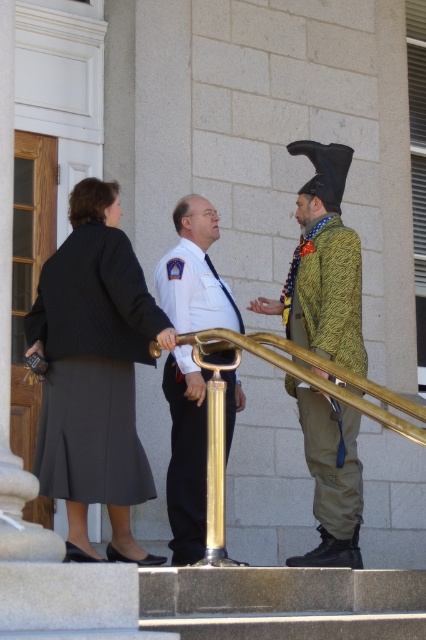
Between dark gray wool skirt at center and white uniform at center, which one appears on the right side from the viewer's perspective?

Positioned to the right is white uniform at center.

Between dark gray wool skirt at center and white uniform at center, which one is positioned higher?

dark gray wool skirt at center

Does point (101, 272) come behind point (233, 323)?

That is False.

Where is `dark gray wool skirt at center`? dark gray wool skirt at center is located at coordinates (94, 371).

Does point (129, 404) come farther from viewer compared to point (310, 305)?

No, it is in front of (310, 305).

What are the coordinates of `dark gray wool skirt at center` in the screenshot? It's located at [x=94, y=371].

In order to click on dark gray wool skirt at center in this screenshot , I will do `click(94, 371)`.

Is point (183, 556) positioned after point (314, 465)?

No, (183, 556) is closer to viewer.

Who is higher up, white uniform at center or green textured jacket at right?

green textured jacket at right is higher up.

Find the location of a particular element. white uniform at center is located at coordinates (186, 456).